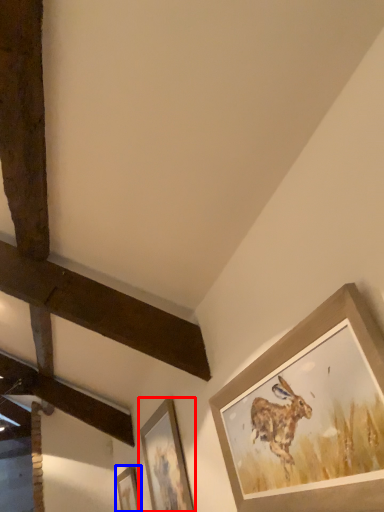
Question: Which object appears closest to the camera in this image, picture frame (highlighted by a red box) or picture frame (highlighted by a blue box)?

Choices:
 (A) picture frame
 (B) picture frame

Answer: (A)